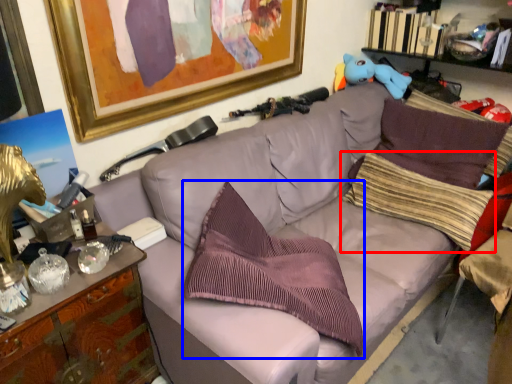
Question: Among these objects, which one is nearest to the camera, pillow (highlighted by a red box) or pillow (highlighted by a blue box)?

Choices:
 (A) pillow
 (B) pillow

Answer: (B)